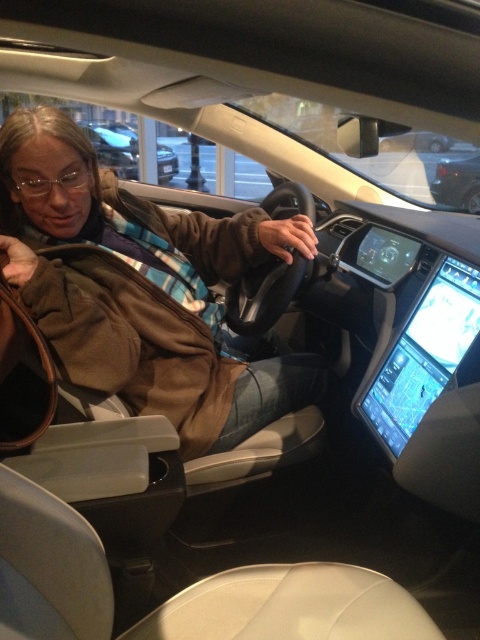
From the picture: Please describe the position of the metallic silver car at upper center in terms of coordinates.

The metallic silver car at upper center is located at coordinates point (115, 145).

From the picture: You are a delivery robot standing at the camera position in the car. You need to place a small package on the dashboard near the point labeled as point (169, 253). Can you reach that point from your current position?

The distance between the camera position and point (169, 253) is 1.81 meters. Since the robot can extend its arm to reach up to 2 meters, it can successfully place the package at that point.

In the scene shown: You are a passenger in the car and want to place your phone on the dashboard. Considering the brown leather jacket at center and the metallic silver car at upper center, which object is taller and can provide a stable surface for placing your phone?

The brown leather jacket at center is much taller than the metallic silver car at upper center. Therefore, the brown leather jacket at center can provide a stable surface for placing your phone.